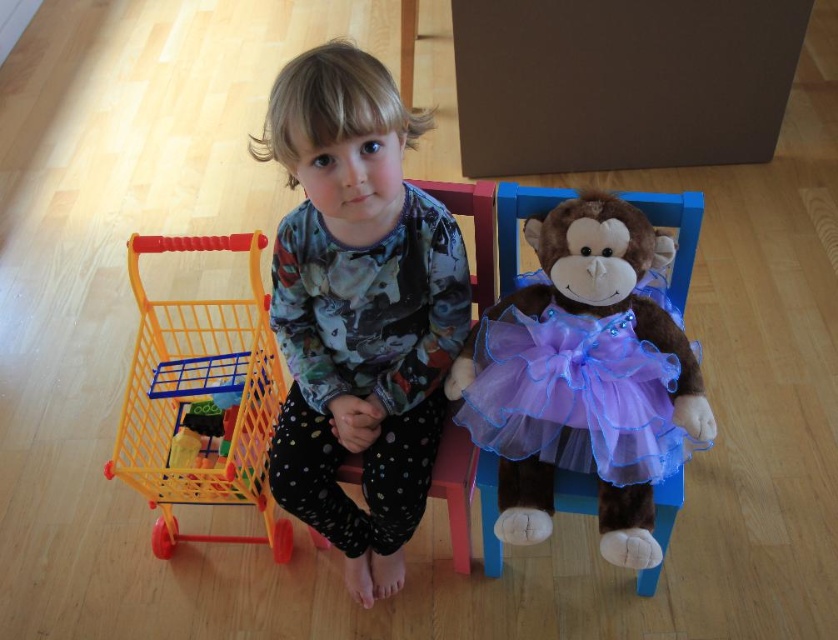
Please look at the image and identify which object is located at the coordinates point (358, 308). The available options are the child in pink chair at center and the yellow toy shopping cart on the left.

The point (358, 308) is on the matte floral pajamas at center, which belongs to the child in pink chair at center.

Please describe the position of the point labeled as point (358, 308) in the image. Is it located on the child or the plush monkey toy?

The point (358, 308) is located on the matte floral pajamas at center, which are worn by the child.